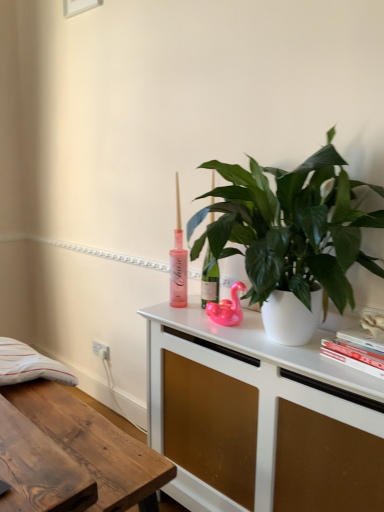
Question: From the image's perspective, is white matte cabinet at center positioned above or below wooden desk at lower left?

Choices:
 (A) above
 (B) below

Answer: (A)

Question: In terms of height, does white matte cabinet at center look taller or shorter compared to wooden desk at lower left?

Choices:
 (A) short
 (B) tall

Answer: (B)

Question: Considering the real-world distances, which object is closest to the wooden desk at lower left?

Choices:
 (A) pink rubber duck at center
 (B) white plastic electric outlet at lower left
 (C) green glossy plant at center
 (D) white matte cabinet at center
 (E) hardcover book at right

Answer: (D)

Question: Which object is the farthest from the hardcover book at right?

Choices:
 (A) wooden desk at lower left
 (B) green glossy plant at center
 (C) pink rubber duck at center
 (D) white plastic electric outlet at lower left
 (E) white matte cabinet at center

Answer: (D)